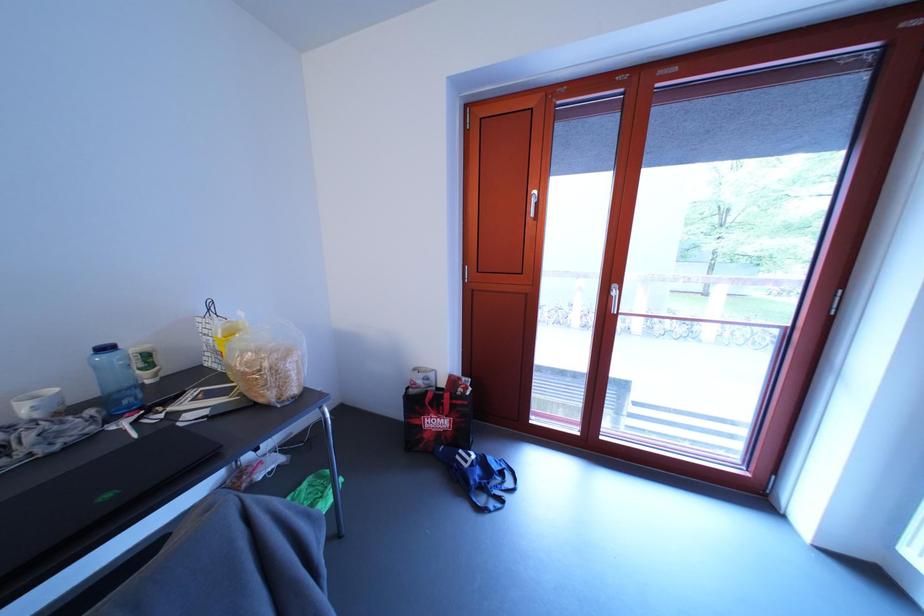
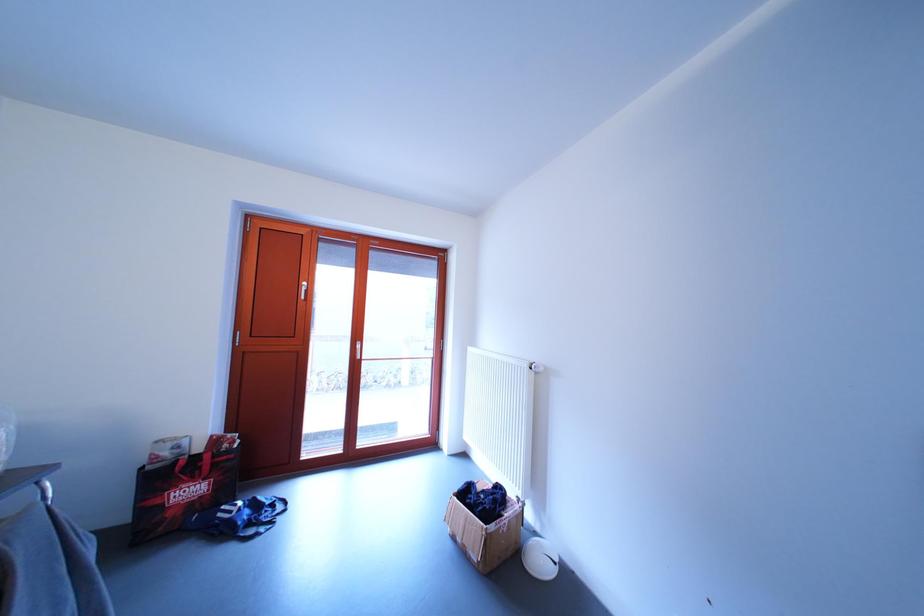
Question: The images are taken continuously from a first-person perspective. In which direction is your viewpoint rotating?

Choices:
 (A) Left
 (B) Right
 (C) Up
 (D) Down

Answer: (B)